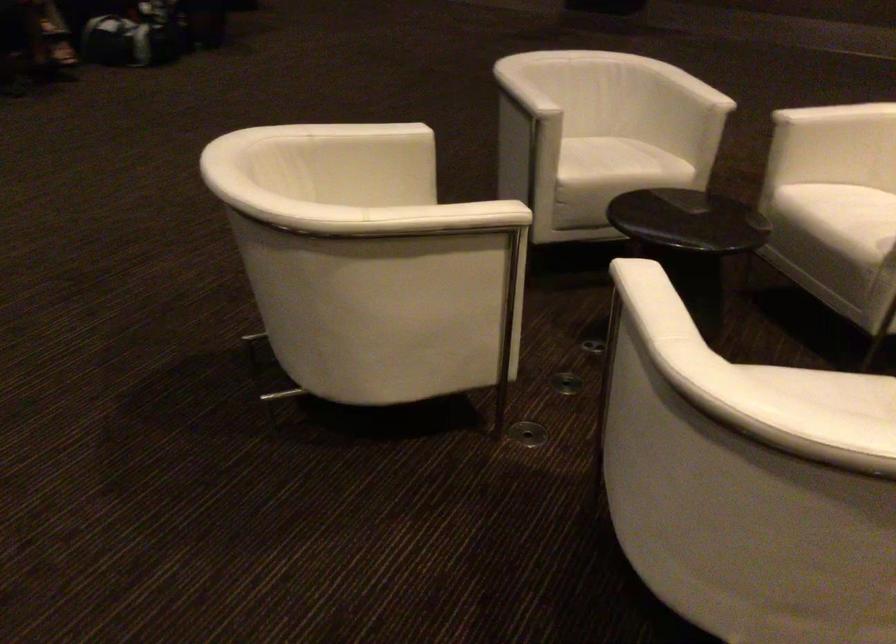
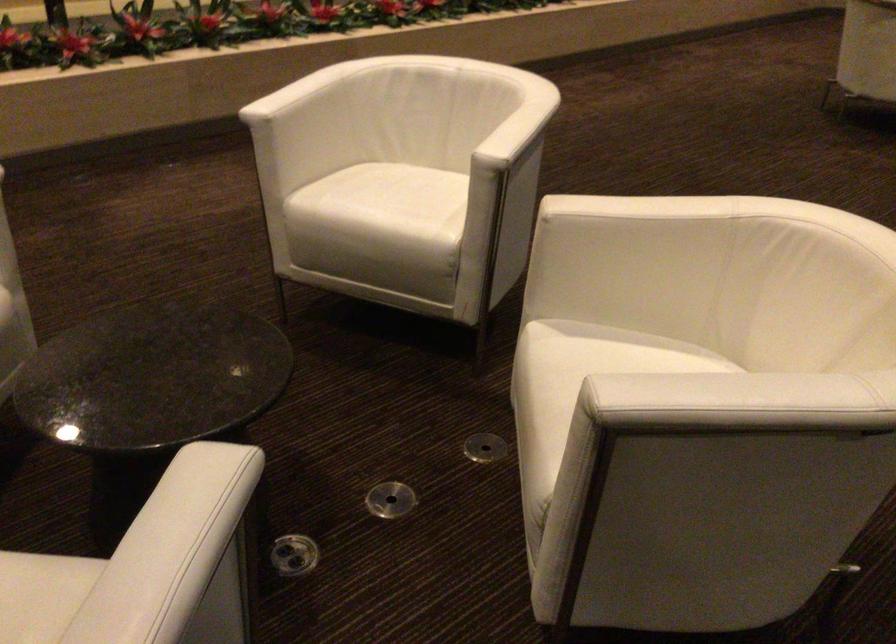
Where in the second image is the point corresponding to the point at 566,389 from the first image?

(391, 500)